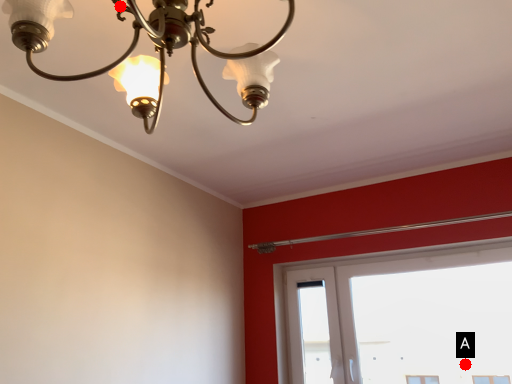
Question: Two points are circled on the image, labeled by A and B beside each circle. Which point is closer to the camera taking this photo?

Choices:
 (A) A is closer
 (B) B is closer

Answer: (B)